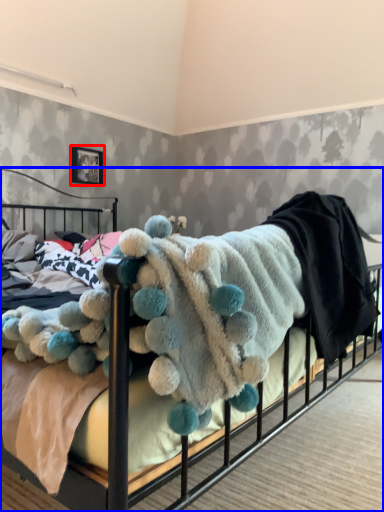
Question: Among these objects, which one is farthest to the camera, picture frame (highlighted by a red box) or bed (highlighted by a blue box)?

Choices:
 (A) picture frame
 (B) bed

Answer: (A)